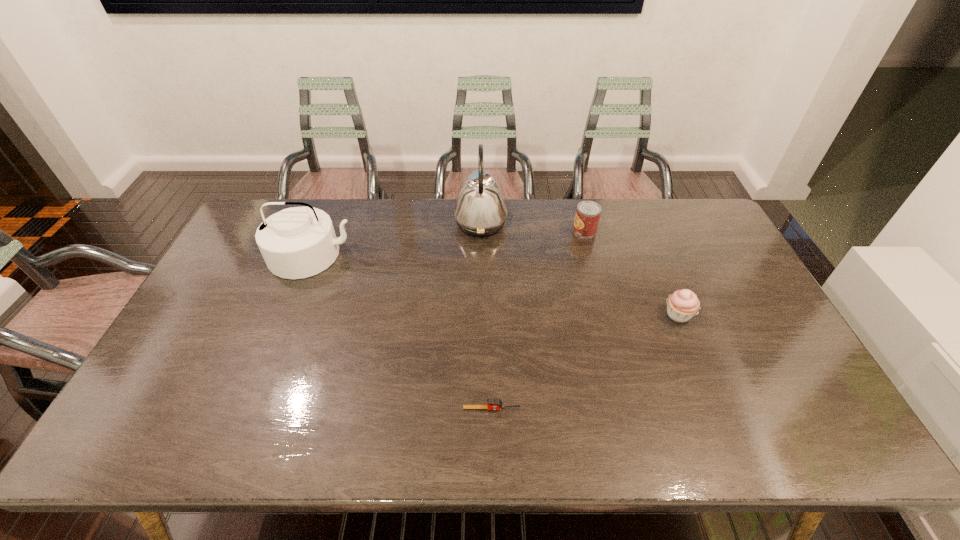
Identify the location of the taller kettle. (480, 210).

Find the location of a particular element. the right kettle is located at coordinates click(x=480, y=210).

Locate an element on the screen. The image size is (960, 540). the leftmost object is located at coordinates (299, 242).

Where is `the left kettle`? The height and width of the screenshot is (540, 960). the left kettle is located at coordinates (299, 242).

The width and height of the screenshot is (960, 540). I want to click on cupcake, so (682, 305).

Locate an element on the screen. This screenshot has height=540, width=960. the second nearest object is located at coordinates (682, 305).

Find the location of a particular element. the fourth object from left to right is located at coordinates (587, 216).

Where is `the shortest object`? This screenshot has height=540, width=960. the shortest object is located at coordinates pyautogui.click(x=492, y=403).

Image resolution: width=960 pixels, height=540 pixels. In order to click on tape measure in this screenshot , I will do `click(492, 403)`.

In order to click on blank area located 0.280m from the spout of the taller kettle in this screenshot , I will do `click(375, 223)`.